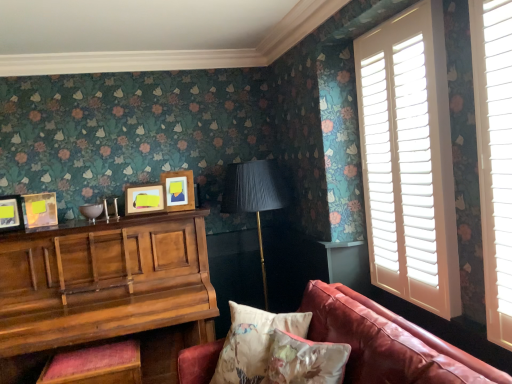
The width and height of the screenshot is (512, 384). I want to click on blank space above velvet red music stool at lower left (from a real-world perspective), so click(x=94, y=354).